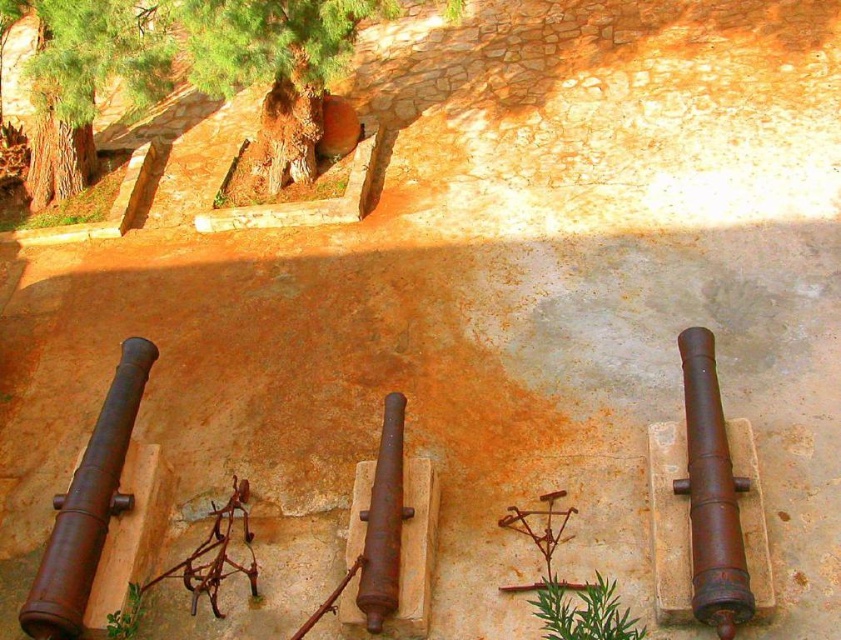
Between green rough bark tree at upper left and green leafy plant at lower center, which one has more height?

With more height is green rough bark tree at upper left.

Can you confirm if green rough bark tree at upper left is positioned to the right of green leafy plant at lower center?

No, green rough bark tree at upper left is not to the right of green leafy plant at lower center.

Is point (85, 84) in front of point (541, 595)?

That is False.

Locate an element on the screen. green rough bark tree at upper left is located at coordinates (83, 77).

The height and width of the screenshot is (640, 841). What do you see at coordinates (712, 493) in the screenshot?
I see `rusty metal cannon at right` at bounding box center [712, 493].

Between point (697, 516) and point (128, 637), which one is positioned behind?

Point (128, 637)

Measure the distance between point (697, 461) and camera.

The distance of point (697, 461) from camera is 14.40 feet.

Find the location of a particular element. This screenshot has height=640, width=841. rusty metal cannon at right is located at coordinates (712, 493).

Does brown rough bark tree at upper center appear on the left side of rusty metal cannon at left?

In fact, brown rough bark tree at upper center is to the right of rusty metal cannon at left.

This screenshot has width=841, height=640. I want to click on brown rough bark tree at upper center, so click(x=276, y=67).

The width and height of the screenshot is (841, 640). Identify the location of brown rough bark tree at upper center. (276, 67).